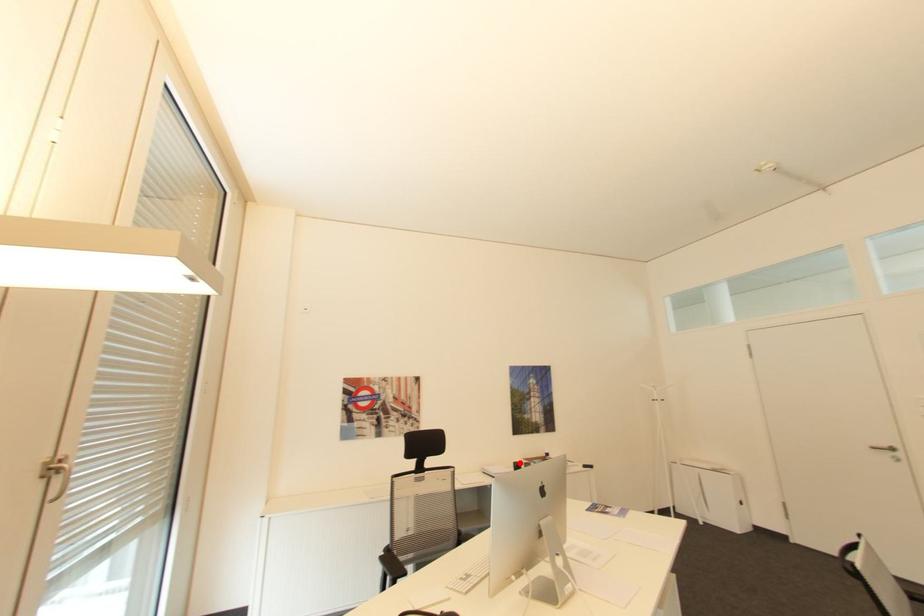
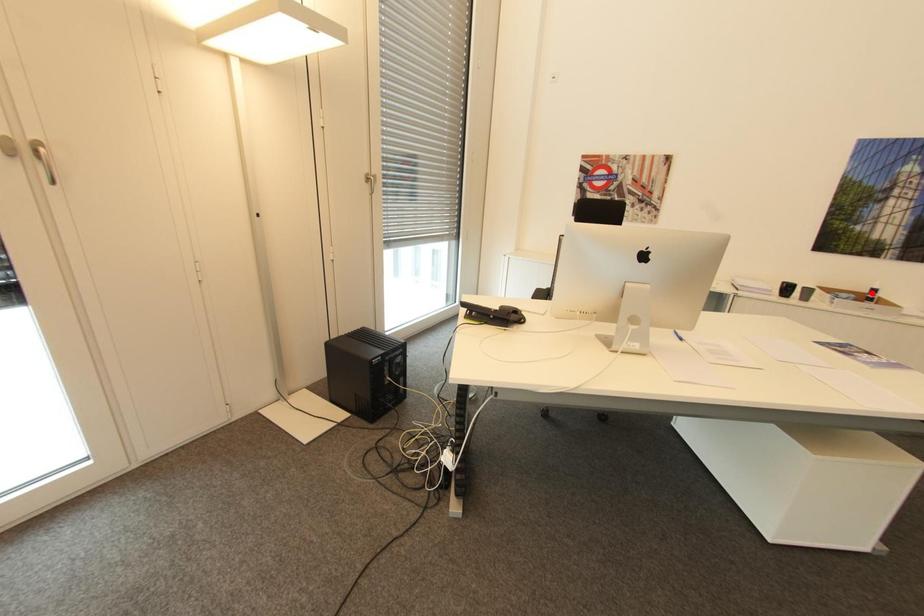
I am providing you with two images of the same scene from different viewpoints. A red point is marked on the first image and another point is marked on the second image. Do the highlighted points in image1 and image2 indicate the same real-world spot?

No